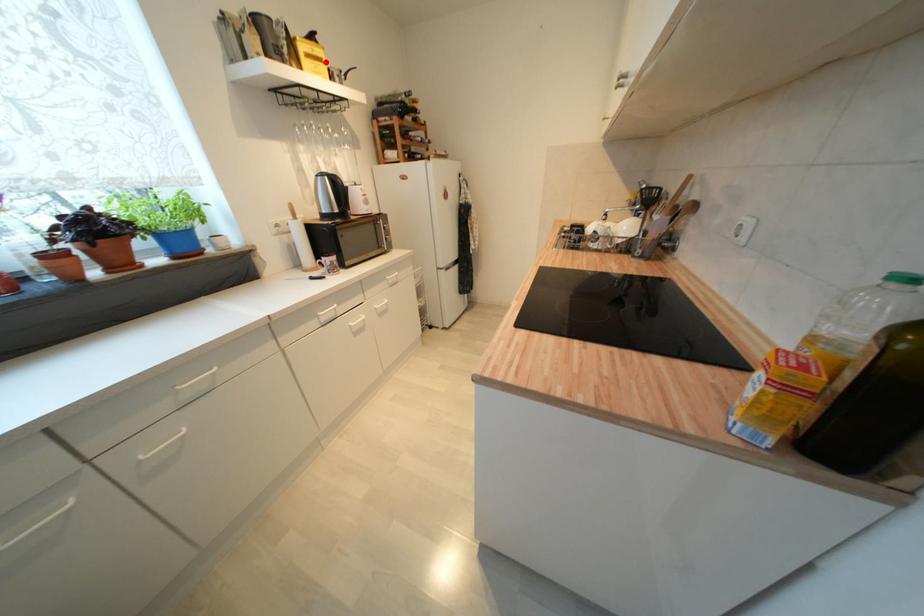
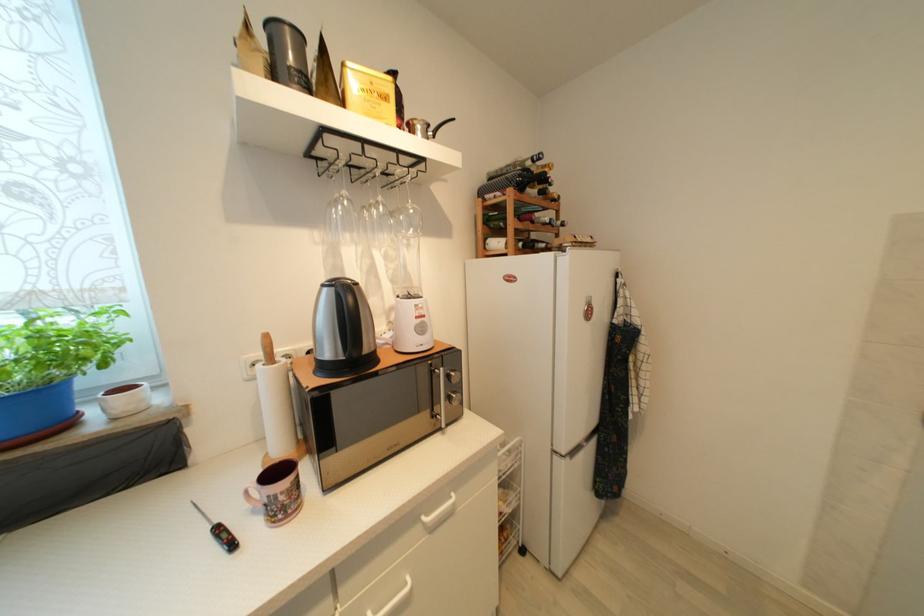
Locate, in the second image, the point that corresponds to the highlighted location in the first image.

(391, 100)